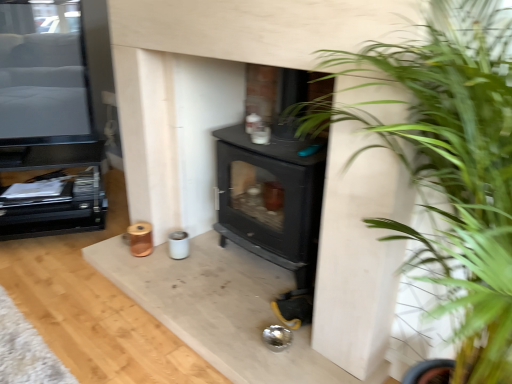
The width and height of the screenshot is (512, 384). What do you see at coordinates (55, 192) in the screenshot?
I see `black matte entertainment center at left, which is counted as the second entertainment center, starting from the top` at bounding box center [55, 192].

Locate an element on the screen. black glossy tv at upper left, positioned as the 2th entertainment center in bottom-to-top order is located at coordinates (54, 112).

Is green leafy plant at center right directly adjacent to black glossy tv at upper left, placed as the 1th entertainment center when sorted from top to bottom?

No, green leafy plant at center right is not touching black glossy tv at upper left, placed as the 1th entertainment center when sorted from top to bottom.

Could you tell me if green leafy plant at center right is turned towards black glossy tv at upper left, positioned as the 2th entertainment center in bottom-to-top order?

No, green leafy plant at center right is not oriented towards black glossy tv at upper left, positioned as the 2th entertainment center in bottom-to-top order.

Considering the sizes of green leafy plant at center right and black glossy tv at upper left, positioned as the 2th entertainment center in bottom-to-top order, in the image, is green leafy plant at center right wider or thinner than black glossy tv at upper left, positioned as the 2th entertainment center in bottom-to-top order,?

green leafy plant at center right is wider than black glossy tv at upper left, positioned as the 2th entertainment center in bottom-to-top order.

Is point (422, 156) closer or farther from the camera than point (97, 217)?

Point (422, 156) appears to be closer to the viewer than point (97, 217).

Is the surface of green leafy plant at center right in direct contact with black matte entertainment center at left, which is counted as the second entertainment center, starting from the top?

green leafy plant at center right is not next to black matte entertainment center at left, which is counted as the second entertainment center, starting from the top, and they're not touching.

Based on their positions, is green leafy plant at center right located to the left or right of black matte entertainment center at left, marked as the first entertainment center in a bottom-to-top arrangement?

From the image, it's evident that green leafy plant at center right is to the right of black matte entertainment center at left, marked as the first entertainment center in a bottom-to-top arrangement.

Which object is closer to the camera taking this photo, green leafy plant at center right or black matte entertainment center at left, which is counted as the second entertainment center, starting from the top?

green leafy plant at center right is in front.

Image resolution: width=512 pixels, height=384 pixels. What are the coordinates of `houseplant on the right side of black matte entertainment center at left, marked as the first entertainment center in a bottom-to-top arrangement` in the screenshot? It's located at (449, 165).

Is black matte entertainment center at left, marked as the first entertainment center in a bottom-to-top arrangement, not close to black glossy tv at upper left, positioned as the 2th entertainment center in bottom-to-top order?

That's not correct — black matte entertainment center at left, marked as the first entertainment center in a bottom-to-top arrangement, is a little close to black glossy tv at upper left, positioned as the 2th entertainment center in bottom-to-top order.

In the scene shown: Which is more to the right, black matte entertainment center at left, marked as the first entertainment center in a bottom-to-top arrangement, or black glossy tv at upper left, positioned as the 2th entertainment center in bottom-to-top order?

Positioned to the right is black glossy tv at upper left, positioned as the 2th entertainment center in bottom-to-top order.

Is black matte entertainment center at left, marked as the first entertainment center in a bottom-to-top arrangement, taller or shorter than black glossy tv at upper left, placed as the 1th entertainment center when sorted from top to bottom?

Clearly, black matte entertainment center at left, marked as the first entertainment center in a bottom-to-top arrangement, is shorter compared to black glossy tv at upper left, placed as the 1th entertainment center when sorted from top to bottom.

Find the location of a particular element. Image resolution: width=512 pixels, height=384 pixels. entertainment center above the black matte entertainment center at left, marked as the first entertainment center in a bottom-to-top arrangement (from a real-world perspective) is located at coordinates (54, 112).

Who is shorter, black matte entertainment center at left, which is counted as the second entertainment center, starting from the top, or green leafy plant at center right?

A: With less height is black matte entertainment center at left, which is counted as the second entertainment center, starting from the top.

Are black matte entertainment center at left, which is counted as the second entertainment center, starting from the top, and green leafy plant at center right located far from each other?

Yes, black matte entertainment center at left, which is counted as the second entertainment center, starting from the top, and green leafy plant at center right are located far from each other.

Based on the photo, from a real-world perspective, is black matte entertainment center at left, which is counted as the second entertainment center, starting from the top, above or below green leafy plant at center right?

black matte entertainment center at left, which is counted as the second entertainment center, starting from the top, is below green leafy plant at center right.

How far apart are black glossy tv at upper left, placed as the 1th entertainment center when sorted from top to bottom, and green leafy plant at center right?

A distance of 1.67 meters exists between black glossy tv at upper left, placed as the 1th entertainment center when sorted from top to bottom, and green leafy plant at center right.

From the image's perspective, which is above, black glossy tv at upper left, placed as the 1th entertainment center when sorted from top to bottom, or green leafy plant at center right?

From the image's view, black glossy tv at upper left, placed as the 1th entertainment center when sorted from top to bottom, is above.

Can you confirm if black glossy tv at upper left, positioned as the 2th entertainment center in bottom-to-top order, is bigger than green leafy plant at center right?

No.

Is green leafy plant at center right a part of black glossy tv at upper left, positioned as the 2th entertainment center in bottom-to-top order?

No, green leafy plant at center right is located outside of black glossy tv at upper left, positioned as the 2th entertainment center in bottom-to-top order.

Which of these two, black glossy tv at upper left, positioned as the 2th entertainment center in bottom-to-top order, or black matte entertainment center at left, marked as the first entertainment center in a bottom-to-top arrangement, is smaller?

Smaller between the two is black glossy tv at upper left, positioned as the 2th entertainment center in bottom-to-top order.

The width and height of the screenshot is (512, 384). Find the location of `entertainment center lying on the left of black glossy tv at upper left, placed as the 1th entertainment center when sorted from top to bottom`. entertainment center lying on the left of black glossy tv at upper left, placed as the 1th entertainment center when sorted from top to bottom is located at coordinates (55, 192).

Identify the location of houseplant on the right of black glossy tv at upper left, positioned as the 2th entertainment center in bottom-to-top order. This screenshot has width=512, height=384. (449, 165).

I want to click on entertainment center that is the 2nd object located behind the green leafy plant at center right, so click(55, 192).

When comparing their distances from black glossy tv at upper left, placed as the 1th entertainment center when sorted from top to bottom, does black matte entertainment center at left, which is counted as the second entertainment center, starting from the top, or green leafy plant at center right seem closer?

black matte entertainment center at left, which is counted as the second entertainment center, starting from the top, lies closer to black glossy tv at upper left, placed as the 1th entertainment center when sorted from top to bottom, than the other object.

Based on their spatial positions, is black glossy tv at upper left, placed as the 1th entertainment center when sorted from top to bottom, or green leafy plant at center right closer to black matte entertainment center at left, marked as the first entertainment center in a bottom-to-top arrangement?

black glossy tv at upper left, placed as the 1th entertainment center when sorted from top to bottom.

Considering their positions, is black glossy tv at upper left, positioned as the 2th entertainment center in bottom-to-top order, positioned closer to green leafy plant at center right than black matte entertainment center at left, which is counted as the second entertainment center, starting from the top?

black matte entertainment center at left, which is counted as the second entertainment center, starting from the top, is positioned closer to the anchor green leafy plant at center right.

Which object lies nearer to the anchor point green leafy plant at center right, black matte entertainment center at left, marked as the first entertainment center in a bottom-to-top arrangement, or black glossy tv at upper left, positioned as the 2th entertainment center in bottom-to-top order?

black matte entertainment center at left, marked as the first entertainment center in a bottom-to-top arrangement, lies closer to green leafy plant at center right than the other object.

Looking at the image, which one is located closer to black matte entertainment center at left, which is counted as the second entertainment center, starting from the top, green leafy plant at center right or black glossy tv at upper left, positioned as the 2th entertainment center in bottom-to-top order?

black glossy tv at upper left, positioned as the 2th entertainment center in bottom-to-top order, is positioned closer to the anchor black matte entertainment center at left, which is counted as the second entertainment center, starting from the top.

Looking at the image, which one is located closer to black glossy tv at upper left, positioned as the 2th entertainment center in bottom-to-top order, green leafy plant at center right or black matte entertainment center at left, marked as the first entertainment center in a bottom-to-top arrangement?

black matte entertainment center at left, marked as the first entertainment center in a bottom-to-top arrangement.

Image resolution: width=512 pixels, height=384 pixels. In order to click on entertainment center between green leafy plant at center right and black matte entertainment center at left, marked as the first entertainment center in a bottom-to-top arrangement, along the z-axis in this screenshot , I will do `click(54, 112)`.